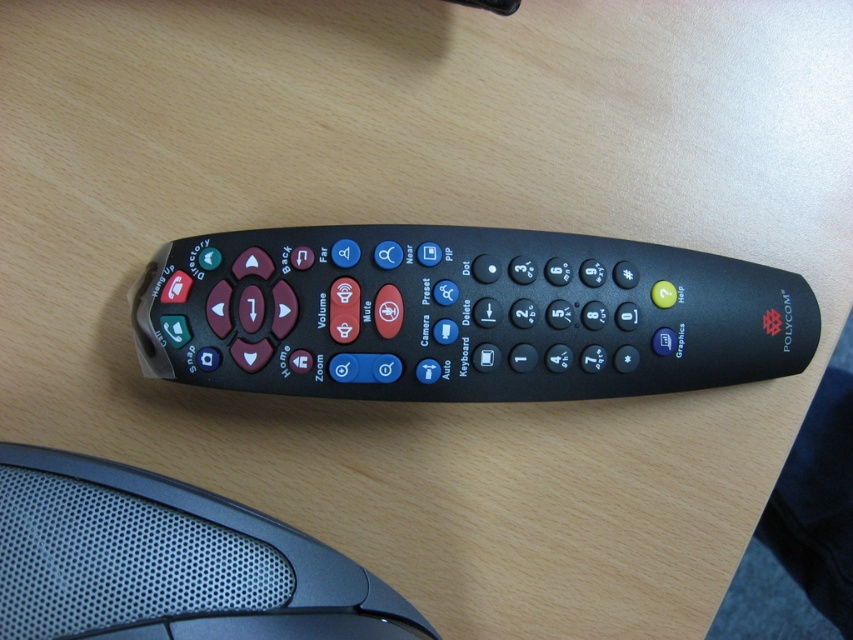
You are holding a smartphone 0.5 meters away from your face. You want to take a photo of the black plastic remote at center without moving your phone. Can you see the remote clearly in your camera view?

The black plastic remote at center is 1.02 meters away from camera. Since your phone is 0.5 meters away from your face, the total distance between the remote and the phone camera would be 1.02 meters minus the distance from your face to the phone. Assuming an average arm length of about 0.7 meters when holding a phone, the total distance from the camera to the remote would be approximately 1.02 meters minus 0.7 meters equals 0.32 meters. Most smartphone cameras can focus on objects within 0.1 to 0.5 meters,

You are setting up a video conferencing system and need to place the black plastic remote at center and the black textured mouse at lower left on a desk. The desk has a 12 inch wide space between them. Is there enough space to place both items without overlapping?

The black plastic remote at center is 10.65 inches away from the black textured mouse at lower left, so yes, there is enough space to place both items without overlapping since the required distance is less than the available 12 inch space.

You are setting up a video conferencing system and need to place the black plastic remote at center and the black textured mouse at lower left on a desk. If you want to ensure the mouse is fully visible without being covered by the remote, should you move the remote to the right or left?

The black plastic remote at center is positioned over black textured mouse at lower left, so to make the mouse fully visible, you should move the remote to the right.